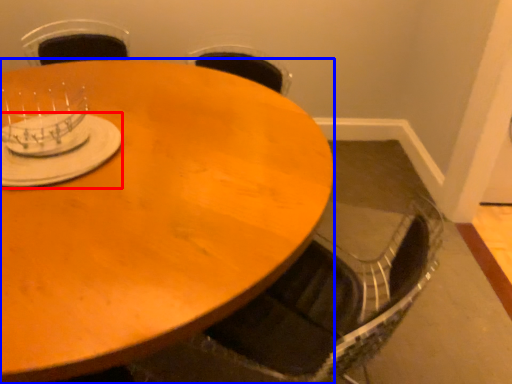
Question: Which point is further to the camera, tableware (highlighted by a red box) or coffee table (highlighted by a blue box)?

Choices:
 (A) tableware
 (B) coffee table

Answer: (A)